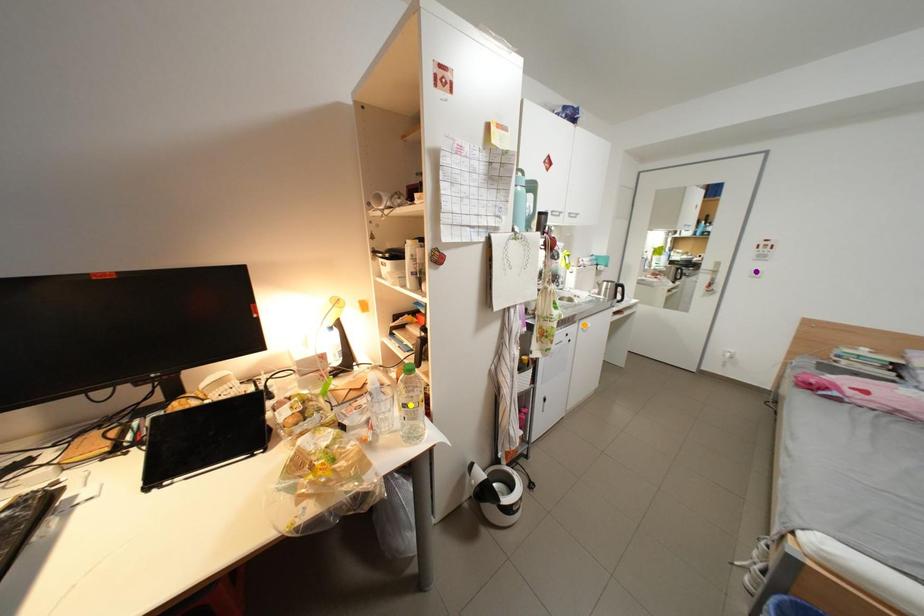
Order these from nearest to farthest:
orange point
yellow point
purple point

1. yellow point
2. orange point
3. purple point